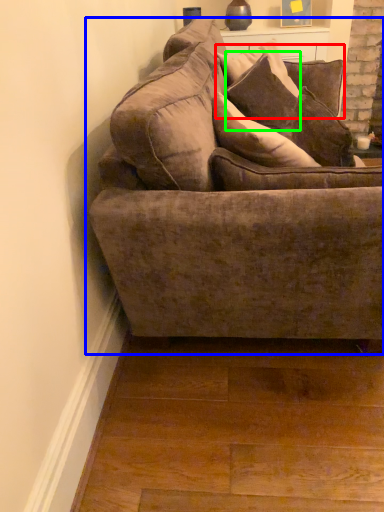
Question: Based on their relative distances, which object is farther from pillow (highlighted by a red box)? Choose from studio couch (highlighted by a blue box) and pillow (highlighted by a green box).

Choices:
 (A) studio couch
 (B) pillow

Answer: (A)